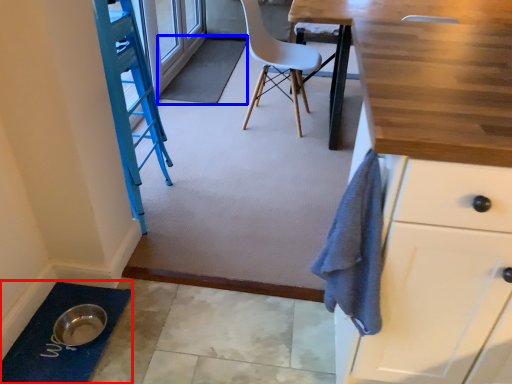
Question: Which object is further to the camera taking this photo, bath mat (highlighted by a red box) or bath mat (highlighted by a blue box)?

Choices:
 (A) bath mat
 (B) bath mat

Answer: (B)